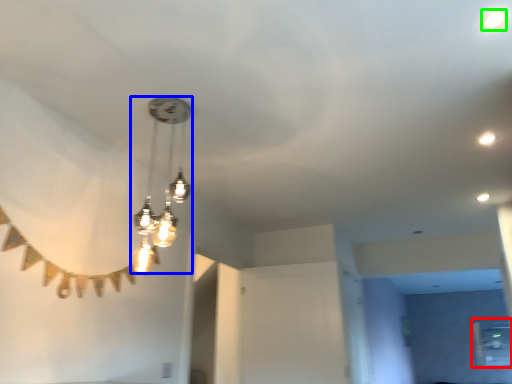
Question: Based on their relative distances, which object is farther from window (highlighted by a red box)? Choose from lamp (highlighted by a blue box) and droplight (highlighted by a green box).

Choices:
 (A) lamp
 (B) droplight

Answer: (B)